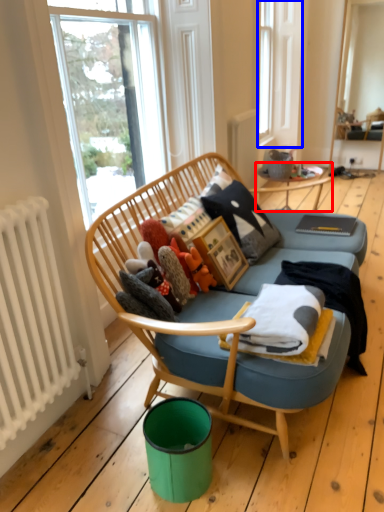
Question: Which object appears farthest to the camera in this image, table (highlighted by a red box) or bay window (highlighted by a blue box)?

Choices:
 (A) table
 (B) bay window

Answer: (B)